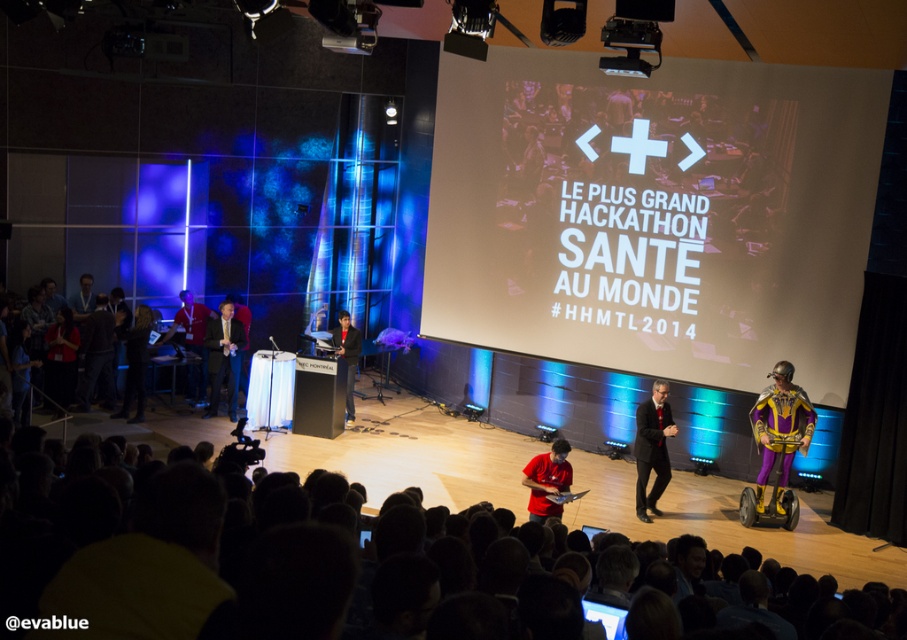
Question: Does purple metallic suit at right appear over black leather jacket at center?

Choices:
 (A) no
 (B) yes

Answer: (A)

Question: Is black suit at center positioned at the back of matte red shirt at center?

Choices:
 (A) yes
 (B) no

Answer: (A)

Question: Which object is positioned farthest from the dark suit at center?

Choices:
 (A) dark brown hair at lower center
 (B) purple metallic suit at right

Answer: (A)

Question: Which point is closer to the camera?

Choices:
 (A) (158, 600)
 (B) (761, 484)
 (C) (547, 492)

Answer: (A)

Question: Which point is closer to the camera taking this photo?

Choices:
 (A) (544, 483)
 (B) (773, 428)

Answer: (A)

Question: Is dark suit at center smaller than black leather jacket at center?

Choices:
 (A) no
 (B) yes

Answer: (A)